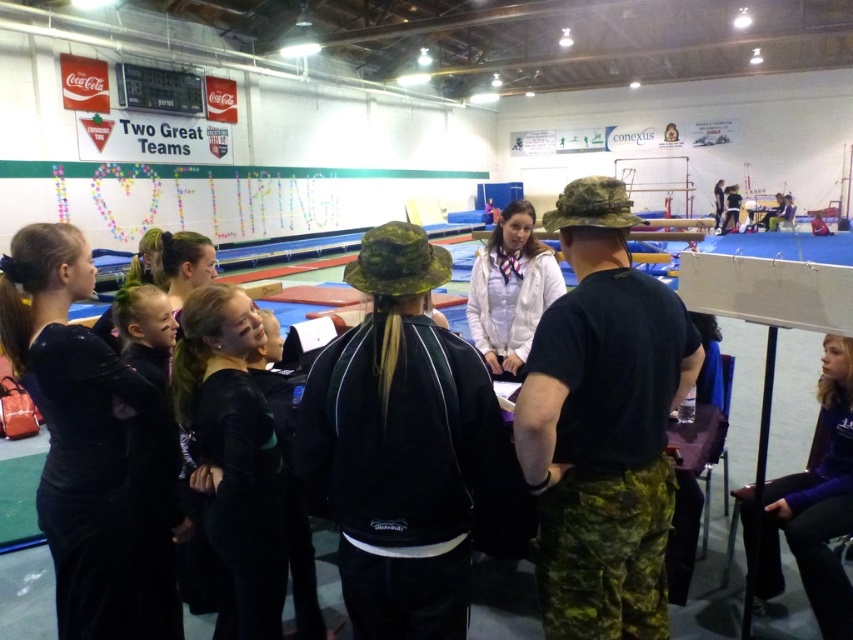
You are standing in the gymnasium and see two points marked in the scene. Which point, point (x=183, y=308) or point (x=509, y=294), is closer to you?

Point (x=183, y=308) is closer to the viewer than point (x=509, y=294).

You are standing in the gymnasium and need to find the black matte uniform at center. According to the scene description, where should you look to locate it?

The black matte uniform at center is located at point 0.716 on the x axis and 0.273 on the y axis.

You are a photographer setting up for a group photo in the gymnasium. You need to ensure that both the black velvet dress at center and the purple fleece jacket at lower right are visible in the frame. Based on their positions, which object is closer to the camera and might block the view of the other?

The black velvet dress at center is positioned over the purple fleece jacket at lower right, meaning it is closer to the camera and could potentially block the view of the purple fleece jacket at lower right.